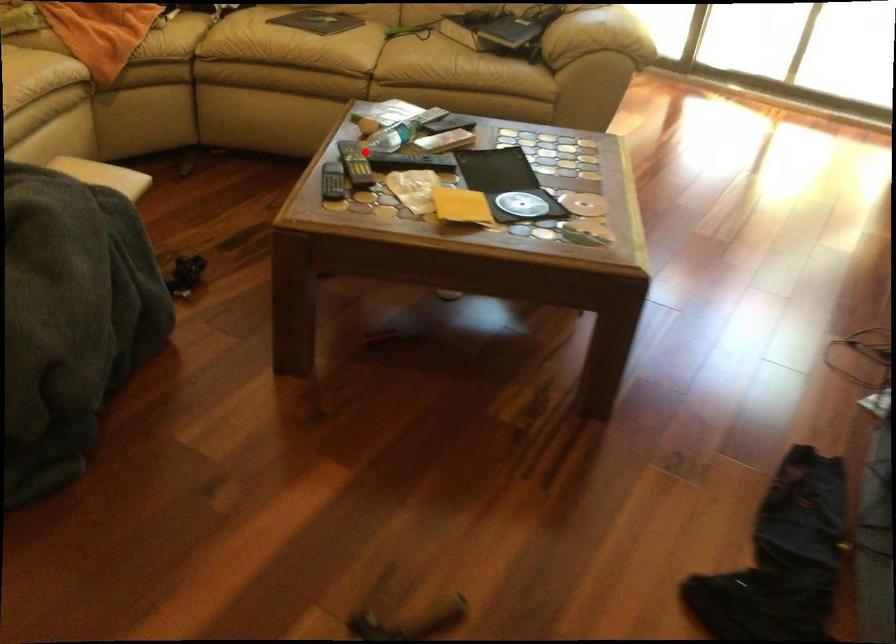
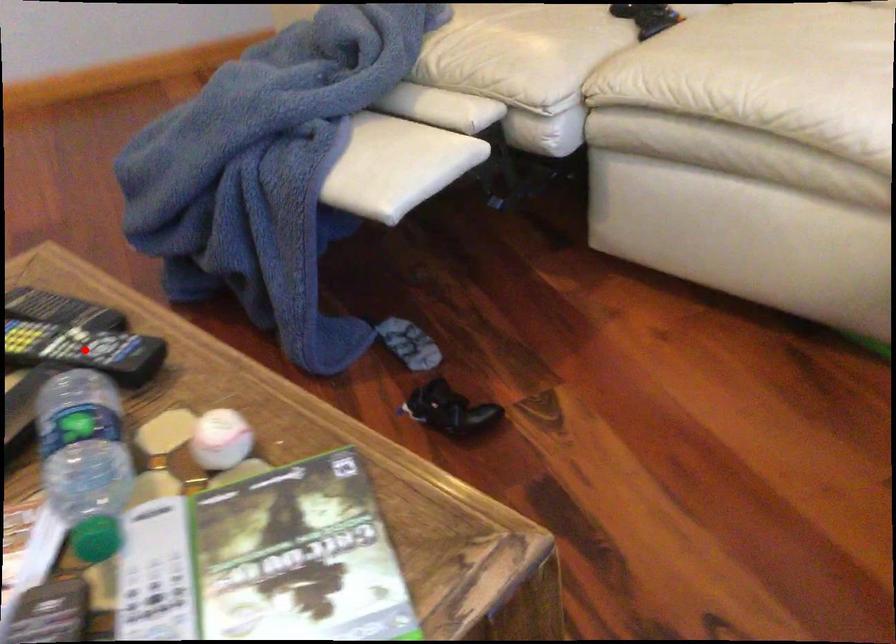
I am providing you with two images of the same scene from different viewpoints. A red point is marked on the first image and another point is marked on the second image. Does the point marked in image1 correspond to the same location as the one in image2?

Yes